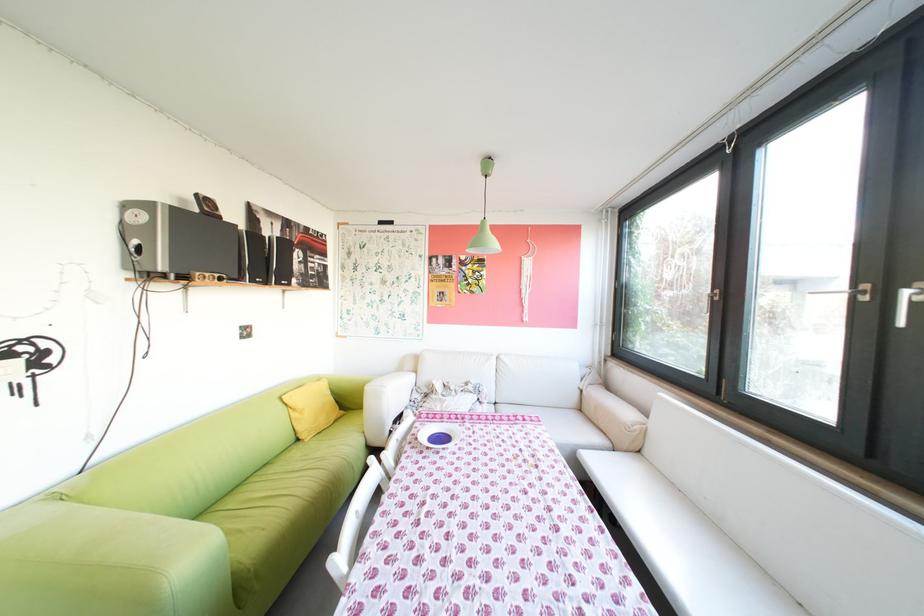
Image resolution: width=924 pixels, height=616 pixels. Identify the location of white bench surface. (808, 572).